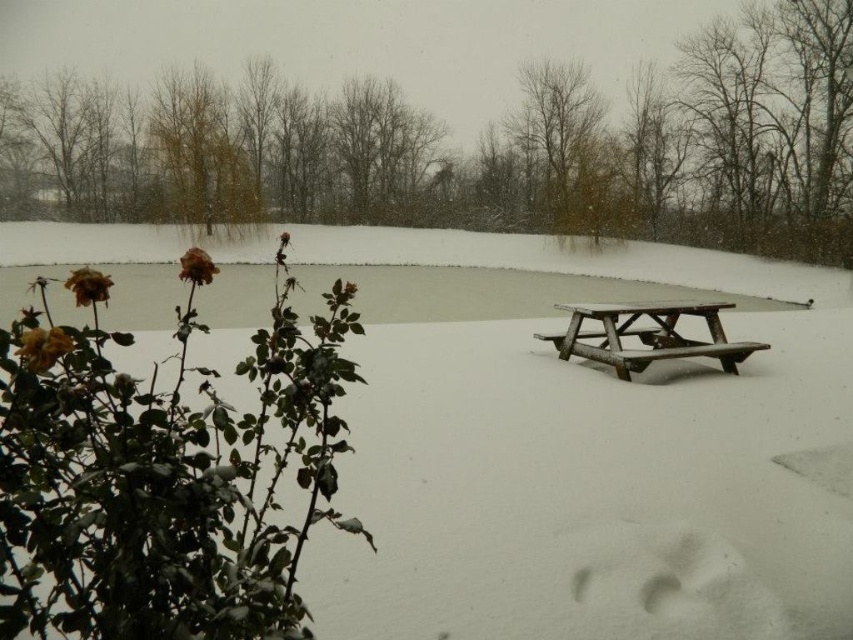
Is point (543, 128) positioned behind point (209, 262)?

Yes, point (543, 128) is farther from viewer.

Does bare branches at upper center appear on the left side of dried rose at left?

In fact, bare branches at upper center is to the right of dried rose at left.

Is point (509, 120) positioned behind point (190, 262)?

That is True.

Identify the location of bare branches at upper center. The width and height of the screenshot is (853, 640). (561, 140).

This screenshot has height=640, width=853. What do you see at coordinates (582, 460) in the screenshot? I see `white matte snow at center` at bounding box center [582, 460].

Which is in front, point (795, 396) or point (570, 205)?

Point (795, 396) is more forward.

Locate an element on the screen. white matte snow at center is located at coordinates (582, 460).

Based on the photo, who is positioned more to the left, wooden picnic table at center or dried matte rose at lower left?

Positioned to the left is dried matte rose at lower left.

Does point (607, 349) come closer to viewer compared to point (48, 346)?

No, (607, 349) is behind (48, 346).

Is point (669, 330) positioned after point (32, 348)?

Yes, point (669, 330) is behind point (32, 348).

Identify the location of wooden picnic table at center. (646, 336).